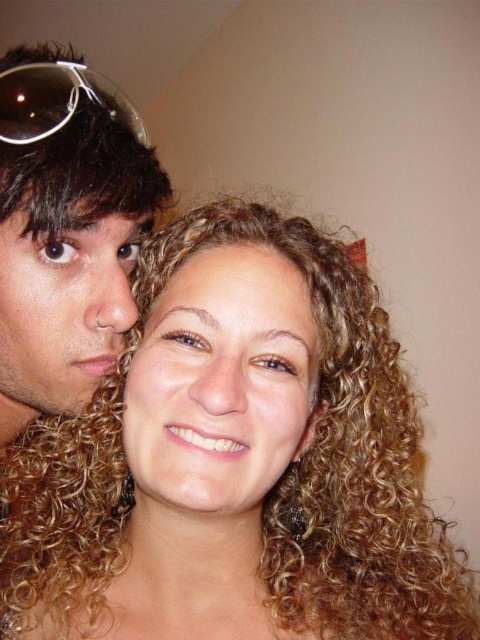
Is matte black hair at left smaller than matte skin face at left?

Answer: Actually, matte black hair at left might be larger than matte skin face at left.

Between matte black hair at left and matte skin face at left, which one is positioned lower?

matte skin face at left

The image size is (480, 640). What do you see at coordinates (64, 230) in the screenshot?
I see `matte black hair at left` at bounding box center [64, 230].

Where is `matte black hair at left`? This screenshot has height=640, width=480. matte black hair at left is located at coordinates (64, 230).

Between matte black hair at left and golden curly hair at center, which one appears on the left side from the viewer's perspective?

matte black hair at left is more to the left.

Does matte black hair at left have a lesser height compared to golden curly hair at center?

No, matte black hair at left is not shorter than golden curly hair at center.

Does point (38, 317) come behind point (123, 413)?

Yes, it is behind point (123, 413).

Where is `matte black hair at left`? matte black hair at left is located at coordinates (64, 230).

Which is more to the left, matte black hair at left or transparent plastic sunglasses at upper left?

matte black hair at left

Between point (16, 93) and point (68, 108), which one is positioned in front?

Point (16, 93) is more forward.

Is point (64, 76) farther from viewer compared to point (108, 81)?

No, (64, 76) is in front of (108, 81).

Find the location of a particular element. The image size is (480, 640). matte black hair at left is located at coordinates [64, 230].